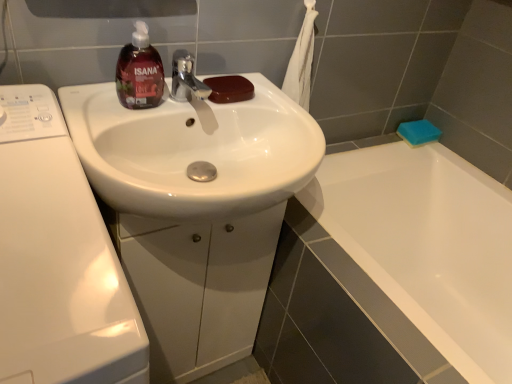
At what (x,y) coordinates should I click in order to perform the action: click on empty space that is to the right of brown glossy soap at center, which is the 1th soap in front-to-back order. Please return your answer as a coordinate pair (x, y). This screenshot has height=384, width=512. Looking at the image, I should click on (277, 108).